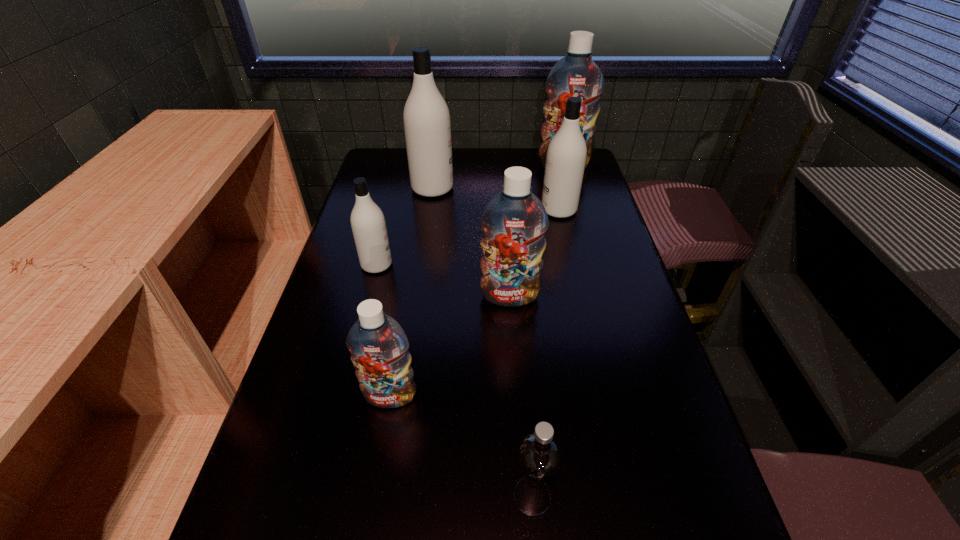
Locate an element on the screen. The image size is (960, 540). the biggest white shampoo is located at coordinates pyautogui.click(x=427, y=125).

This screenshot has width=960, height=540. I want to click on the biggest blue shampoo, so click(x=575, y=75).

Find the location of a particular element. the farthest object is located at coordinates (575, 75).

This screenshot has width=960, height=540. Find the location of `the second smallest white shampoo`. the second smallest white shampoo is located at coordinates (566, 155).

The image size is (960, 540). I want to click on the fifth farthest object, so click(x=514, y=222).

The image size is (960, 540). In order to click on the fourth shampoo from left to right in this screenshot , I will do `click(514, 222)`.

In order to click on the nearest white shampoo in this screenshot , I will do [x=368, y=223].

Image resolution: width=960 pixels, height=540 pixels. Find the location of `the fourth nearest object`. the fourth nearest object is located at coordinates (368, 223).

Find the location of a particular element. This screenshot has height=540, width=960. the leftmost blue shampoo is located at coordinates (378, 345).

Find the location of a particular element. This screenshot has width=960, height=540. the nearest shampoo is located at coordinates (378, 345).